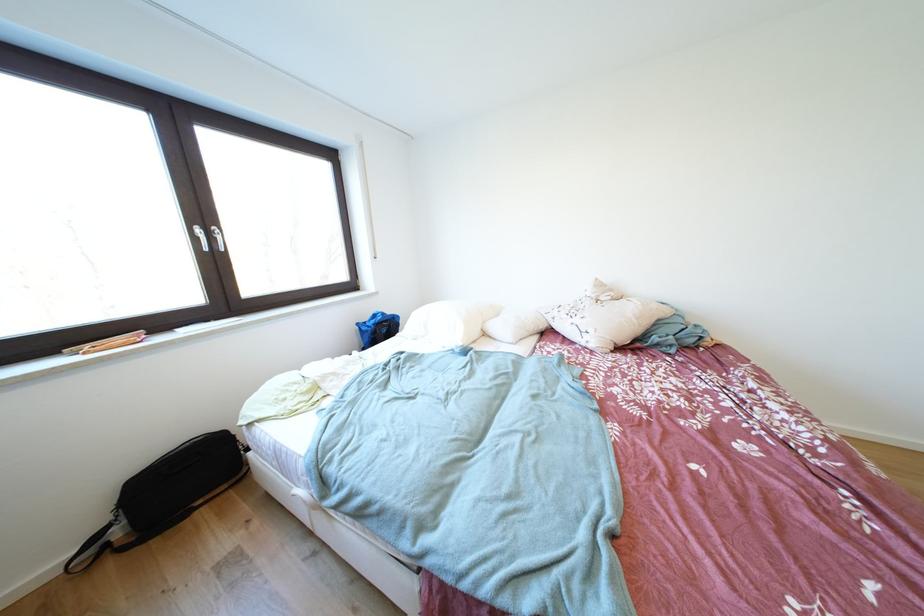
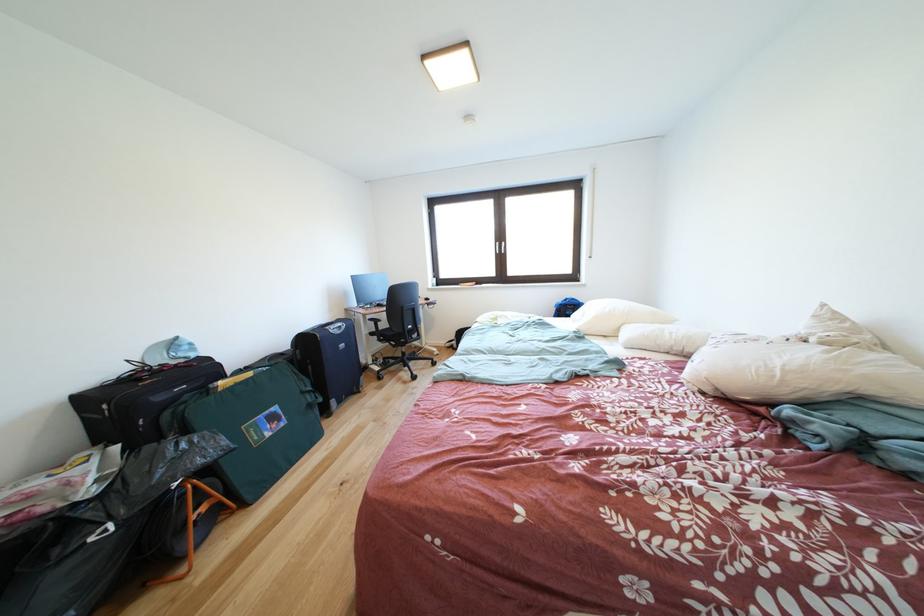
In the second image, find the point that corresponds to (407,321) in the first image.

(591, 310)